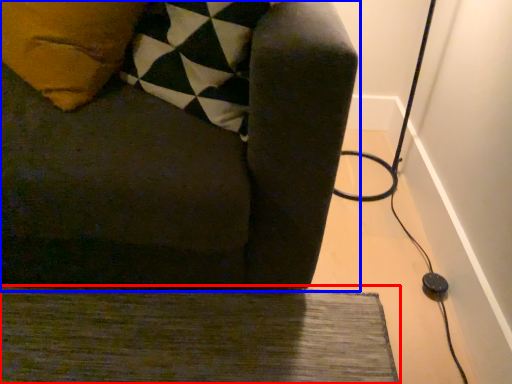
Question: Which point is further to the camera, doormat (highlighted by a red box) or furniture (highlighted by a blue box)?

Choices:
 (A) doormat
 (B) furniture

Answer: (A)